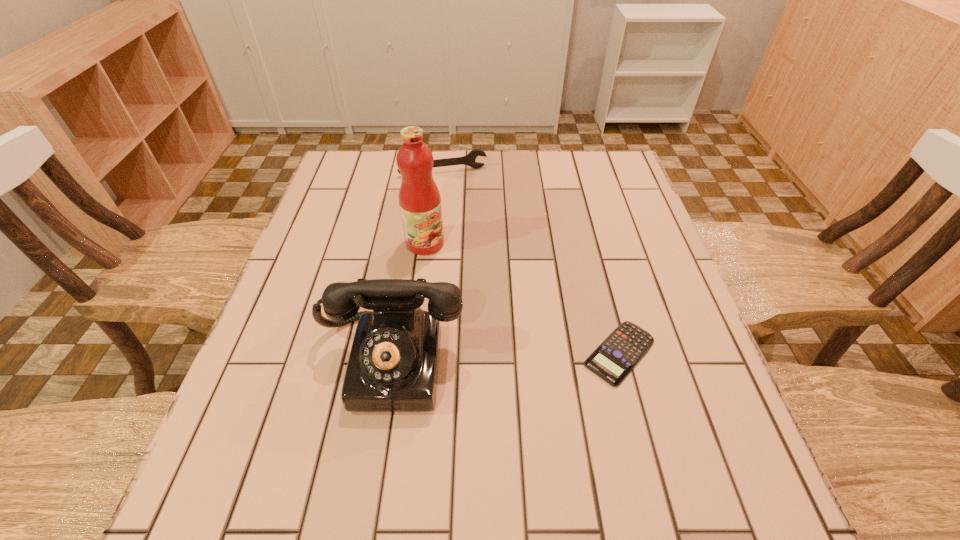
In order to click on vacant space on the desktop that is between the telephone and the calculator and is positioned on the open ends of the farthest object in this screenshot , I will do `click(490, 357)`.

I want to click on free space on the desktop that is between the third shortest object and the shortest object and is positioned on the front label of the tallest object, so click(536, 356).